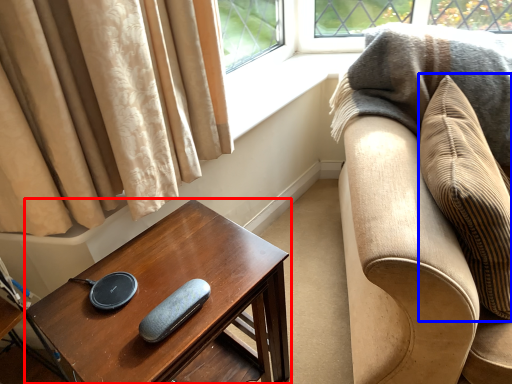
Question: Among these objects, which one is farthest to the camera, table (highlighted by a red box) or pillow (highlighted by a blue box)?

Choices:
 (A) table
 (B) pillow

Answer: (A)